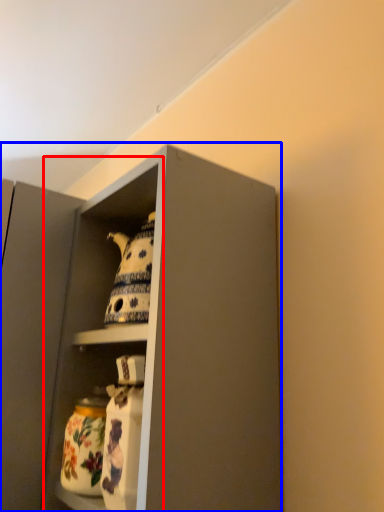
Question: Which object is closer to the camera taking this photo, cabinet (highlighted by a red box) or cabinetry (highlighted by a blue box)?

Choices:
 (A) cabinet
 (B) cabinetry

Answer: (B)